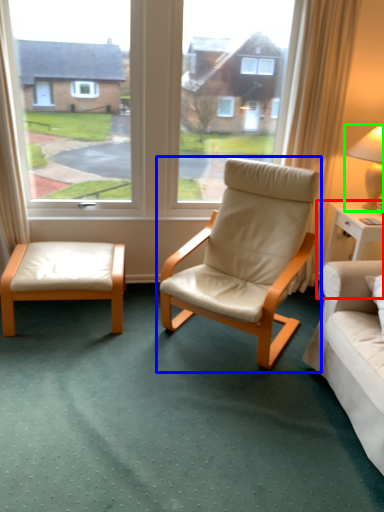
Question: Which object is the farthest from nightstand (highlighted by a red box)? Choose among these: chair (highlighted by a blue box) or table lamp (highlighted by a green box).

Choices:
 (A) chair
 (B) table lamp

Answer: (A)